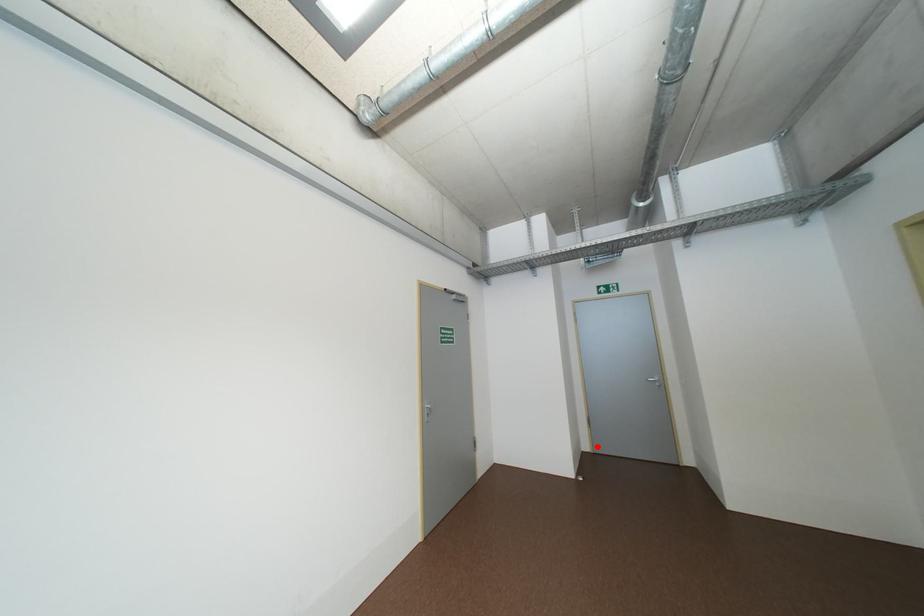
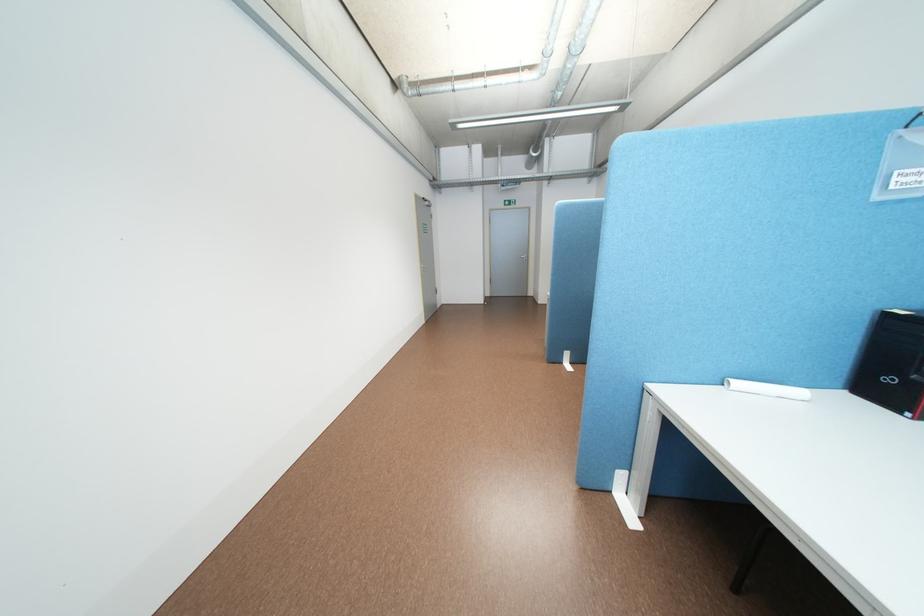
In the second image, find the point that corresponds to the highlighted location in the first image.

(499, 294)